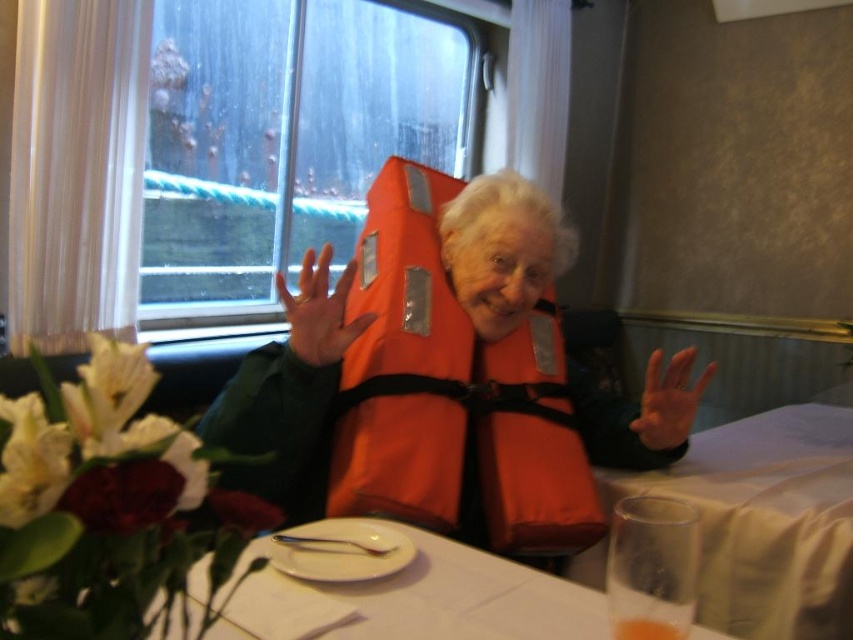
Consider the image. Which is below, transparent glass at lower right or orange matte life vest at center?

transparent glass at lower right

Which is more to the left, transparent glass at lower right or orange matte life vest at center?

Positioned to the left is orange matte life vest at center.

Does point (759, 525) lie behind point (666, 372)?

Yes, point (759, 525) is behind point (666, 372).

Locate an element on the screen. Image resolution: width=853 pixels, height=640 pixels. transparent glass at lower right is located at coordinates (766, 520).

Can you confirm if transparent glass window at upper left is positioned to the left of white paper plate at center?

Correct, you'll find transparent glass window at upper left to the left of white paper plate at center.

Is transparent glass window at upper left smaller than white paper plate at center?

Incorrect, transparent glass window at upper left is not smaller in size than white paper plate at center.

Does point (296, 68) come farther from viewer compared to point (328, 609)?

Yes, it is.

Where is `transparent glass window at upper left`? The height and width of the screenshot is (640, 853). transparent glass window at upper left is located at coordinates (288, 138).

Is orange matte life jacket at center wider than orange life vest at center?

Yes, orange matte life jacket at center is wider than orange life vest at center.

Can you confirm if orange matte life jacket at center is positioned to the left of orange life vest at center?

In fact, orange matte life jacket at center is to the right of orange life vest at center.

The width and height of the screenshot is (853, 640). What do you see at coordinates (451, 394) in the screenshot? I see `orange matte life jacket at center` at bounding box center [451, 394].

This screenshot has height=640, width=853. I want to click on orange matte life jacket at center, so click(451, 394).